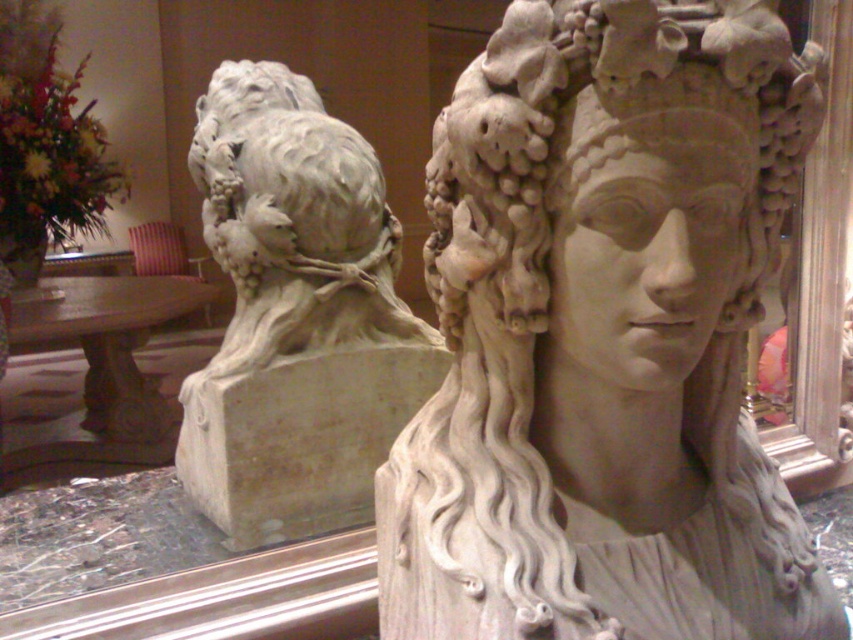
Question: In this image, where is white stone sculpture at center located relative to white marble lion at center?

Choices:
 (A) above
 (B) below

Answer: (B)

Question: Estimate the real-world distances between objects in this image. Which object is closer to the matte stone lion at upper left?

Choices:
 (A) white stone sculpture at center
 (B) white marble lion at center

Answer: (B)

Question: Does white stone sculpture at center have a larger size compared to matte stone lion at upper left?

Choices:
 (A) no
 (B) yes

Answer: (B)

Question: Which object is positioned farthest from the white marble lion at center?

Choices:
 (A) white stone sculpture at center
 (B) matte stone lion at upper left

Answer: (A)

Question: Which is farther from the white stone sculpture at center?

Choices:
 (A) matte stone lion at upper left
 (B) white marble lion at center

Answer: (A)

Question: Does white stone sculpture at center have a larger size compared to white marble lion at center?

Choices:
 (A) yes
 (B) no

Answer: (B)